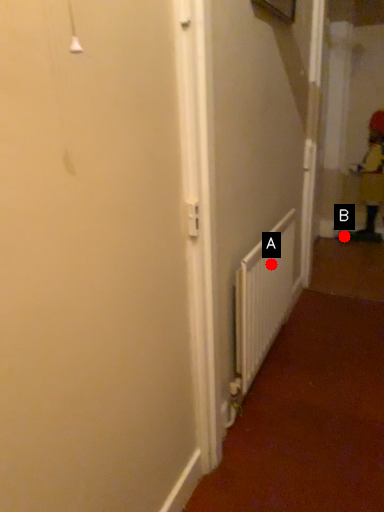
Question: Two points are circled on the image, labeled by A and B beside each circle. Among these points, which one is farthest from the camera?

Choices:
 (A) A is further
 (B) B is further

Answer: (B)